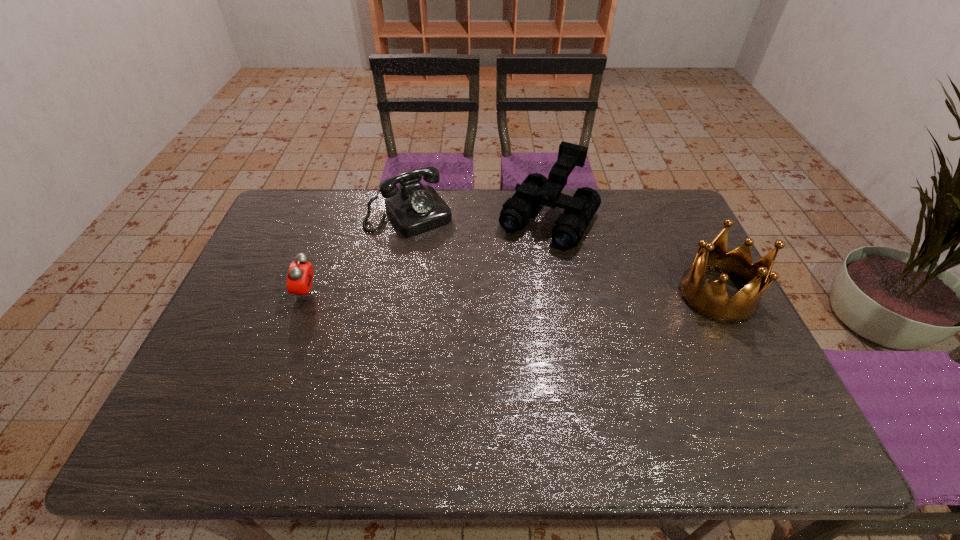
I want to click on vacant space on the desktop that is between the shortest object and the rightmost object and is positioned on the dial of the telephone, so coord(466,294).

At what (x,y) coordinates should I click in order to perform the action: click on free spot on the desktop that is between the leftmost object and the crown and is positioned on the front lenses of the binoculars. Please return your answer as a coordinate pair (x, y). Image resolution: width=960 pixels, height=540 pixels. Looking at the image, I should click on (499, 294).